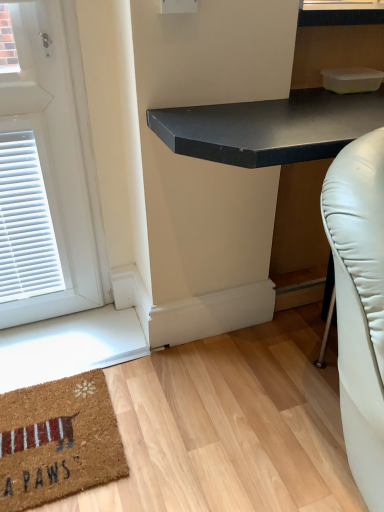
Identify the location of vacant space to the left of black matte desk at center. This screenshot has height=512, width=384. click(99, 392).